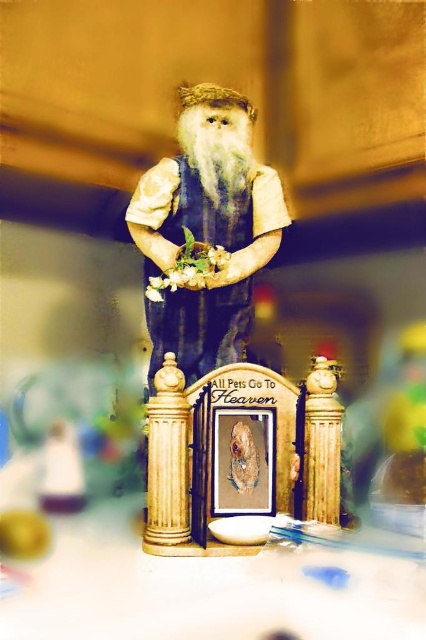
You are a photographer adjusting your camera to focus on two specific points in the image. The first point is at coordinate point (232,260) and the second is at point (207,164). Which point is closer to the camera lens?

Point (232,260) is further to the camera than point (207,164), so the point closer to the camera lens is point (207,164).